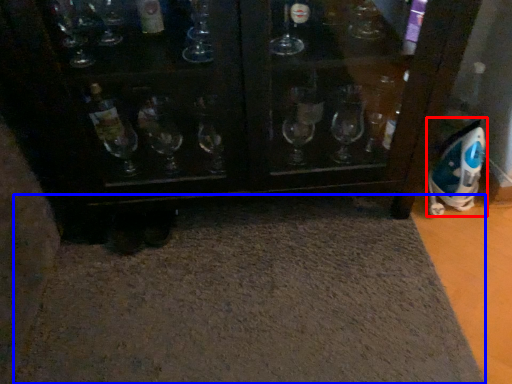
Question: Which point is further to the camera, appliance (highlighted by a red box) or bath mat (highlighted by a blue box)?

Choices:
 (A) appliance
 (B) bath mat

Answer: (A)